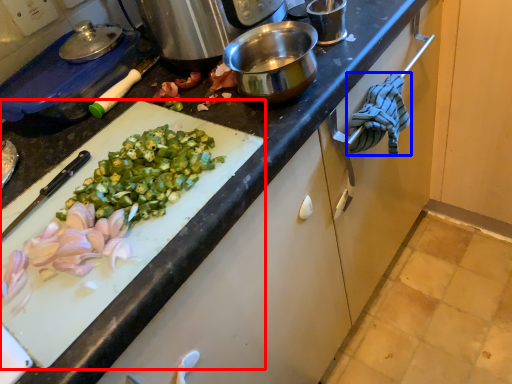
Question: Which object is further to the camera taking this photo, cutting board (highlighted by a red box) or cloth (highlighted by a blue box)?

Choices:
 (A) cutting board
 (B) cloth

Answer: (B)